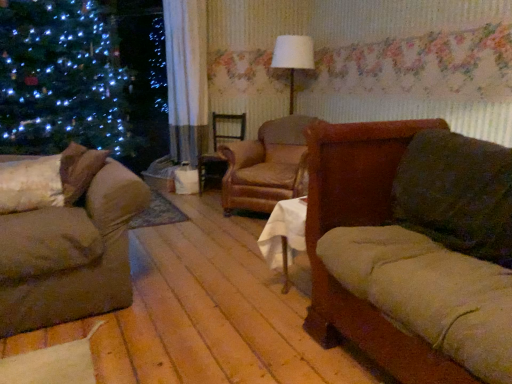
Question: In terms of size, does leather armchair at center appear bigger or smaller than brown leather swivel chair at center?

Choices:
 (A) big
 (B) small

Answer: (A)

Question: Considering their positions, is leather armchair at center located in front of or behind brown leather swivel chair at center?

Choices:
 (A) behind
 (B) front

Answer: (B)

Question: Based on their relative distances, which object is farther from the velvet brown couch at left, which is counted as the 2th studio couch, starting from the right?

Choices:
 (A) brown leather swivel chair at center
 (B) velvet brown couch at right, the second studio couch in the left-to-right sequence
 (C) white fabric lampshade at center
 (D) leather armchair at center
 (E) fluffy white pillow at left

Answer: (C)

Question: Estimate the real-world distances between objects in this image. Which object is closer to the brown leather swivel chair at center?

Choices:
 (A) white fabric lampshade at center
 (B) velvet brown couch at right, the second studio couch in the left-to-right sequence
 (C) fluffy white pillow at left
 (D) leather armchair at center
 (E) velvet brown couch at left, the first studio couch from the left

Answer: (D)